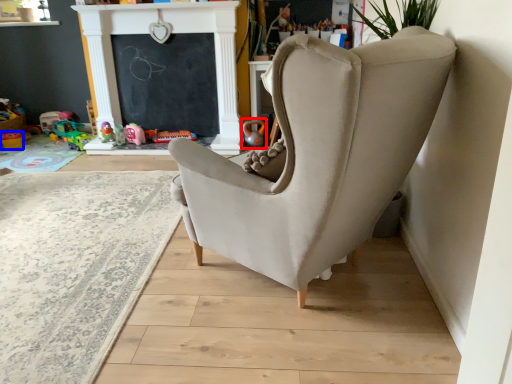
Question: Which of the following is the farthest to the observer, toy (highlighted by a red box) or toy (highlighted by a blue box)?

Choices:
 (A) toy
 (B) toy

Answer: (B)